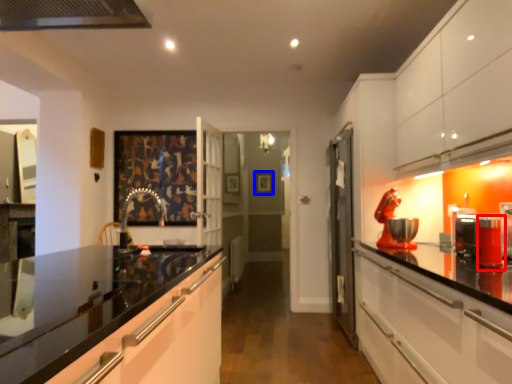
Question: Which object appears closest to the camera in this image, appliance (highlighted by a red box) or picture frame (highlighted by a blue box)?

Choices:
 (A) appliance
 (B) picture frame

Answer: (A)